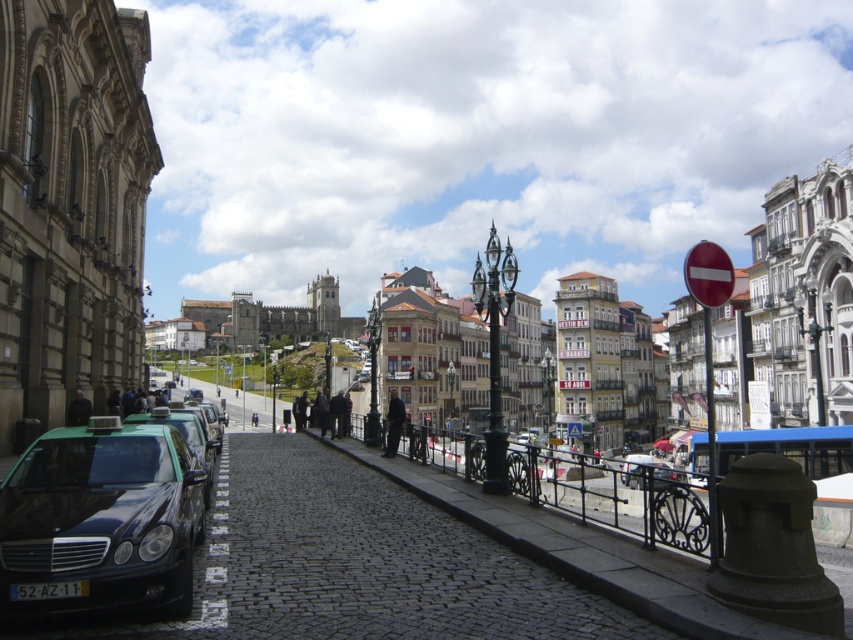
Question: Is dark gray suit at center to the left of dark blue jeans at center from the viewer's perspective?

Choices:
 (A) yes
 (B) no

Answer: (B)

Question: Can you confirm if dark gray fabric jacket at lower left is smaller than dark blue jeans at center?

Choices:
 (A) no
 (B) yes

Answer: (B)

Question: Among these objects, which one is nearest to the camera?

Choices:
 (A) green matte taxi at lower left
 (B) dark blue jeans at center

Answer: (A)

Question: Which object is the closest to the dark gray suit at center?

Choices:
 (A) dark gray fabric jacket at lower left
 (B) green matte taxi at lower left
 (C) dark blue jeans at center

Answer: (A)

Question: Estimate the real-world distances between objects in this image. Which object is closer to the dark gray suit at center?

Choices:
 (A) dark blue jeans at center
 (B) dark gray fabric jacket at lower left
 (C) green matte taxi at lower left

Answer: (B)

Question: Does green matte taxi at lower left have a smaller size compared to dark gray suit at center?

Choices:
 (A) yes
 (B) no

Answer: (B)